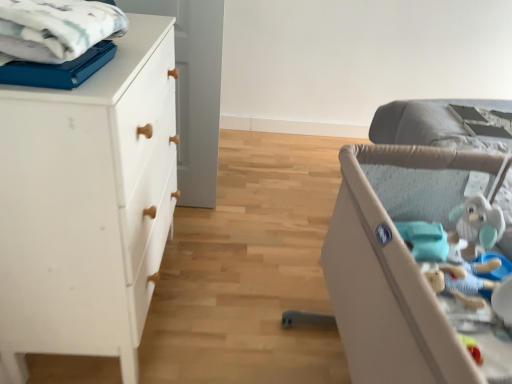
Question: From a real-world perspective, is white matte chest of drawers at left under white cotton blanket at upper left?

Choices:
 (A) no
 (B) yes

Answer: (B)

Question: Does white matte chest of drawers at left have a smaller size compared to white cotton blanket at upper left?

Choices:
 (A) yes
 (B) no

Answer: (B)

Question: Is there a large distance between white matte chest of drawers at left and white cotton blanket at upper left?

Choices:
 (A) yes
 (B) no

Answer: (B)

Question: Does white matte chest of drawers at left have a greater width compared to white cotton blanket at upper left?

Choices:
 (A) no
 (B) yes

Answer: (B)

Question: Are white matte chest of drawers at left and white cotton blanket at upper left making contact?

Choices:
 (A) no
 (B) yes

Answer: (A)

Question: From a real-world perspective, is white matte chest of drawers at left physically above white cotton blanket at upper left?

Choices:
 (A) no
 (B) yes

Answer: (A)

Question: Is white cotton blanket at upper left surrounded by beige fabric infant bed at right?

Choices:
 (A) yes
 (B) no

Answer: (B)

Question: From a real-world perspective, is beige fabric infant bed at right positioned under white cotton blanket at upper left based on gravity?

Choices:
 (A) yes
 (B) no

Answer: (A)

Question: Considering the relative positions of beige fabric infant bed at right and white cotton blanket at upper left in the image provided, is beige fabric infant bed at right to the left of white cotton blanket at upper left from the viewer's perspective?

Choices:
 (A) yes
 (B) no

Answer: (B)

Question: Can you confirm if beige fabric infant bed at right is shorter than white cotton blanket at upper left?

Choices:
 (A) no
 (B) yes

Answer: (A)

Question: Does beige fabric infant bed at right turn towards white cotton blanket at upper left?

Choices:
 (A) yes
 (B) no

Answer: (B)

Question: Is beige fabric infant bed at right touching white cotton blanket at upper left?

Choices:
 (A) yes
 (B) no

Answer: (B)

Question: Can you confirm if white cotton blanket at upper left is bigger than white matte chest of drawers at left?

Choices:
 (A) no
 (B) yes

Answer: (A)